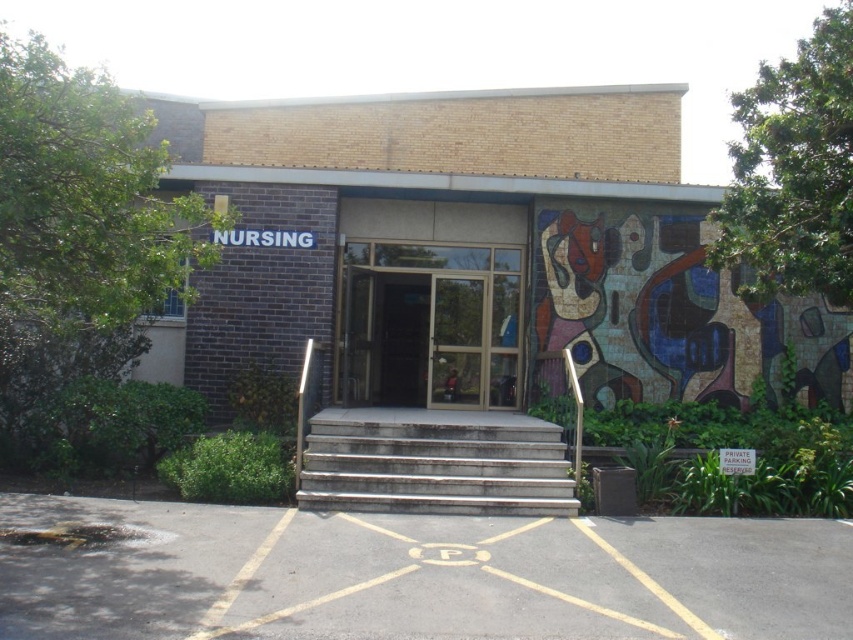
Question: Among these objects, which one is farthest from the camera?

Choices:
 (A) transparent glass door at center
 (B) gray concrete stairs at center

Answer: (A)

Question: Which object appears farthest from the camera in this image?

Choices:
 (A) transparent glass door at center
 (B) gray concrete stairs at center

Answer: (A)

Question: Which of the following is the farthest from the observer?

Choices:
 (A) transparent glass door at center
 (B) gray concrete stairs at center

Answer: (A)

Question: From the image, what is the correct spatial relationship of transparent glass door at center in relation to gray concrete stairs at center?

Choices:
 (A) left
 (B) right

Answer: (A)

Question: Does transparent glass door at center lie behind gray concrete stairs at center?

Choices:
 (A) yes
 (B) no

Answer: (A)

Question: Is transparent glass door at center smaller than gray concrete stairs at center?

Choices:
 (A) no
 (B) yes

Answer: (B)